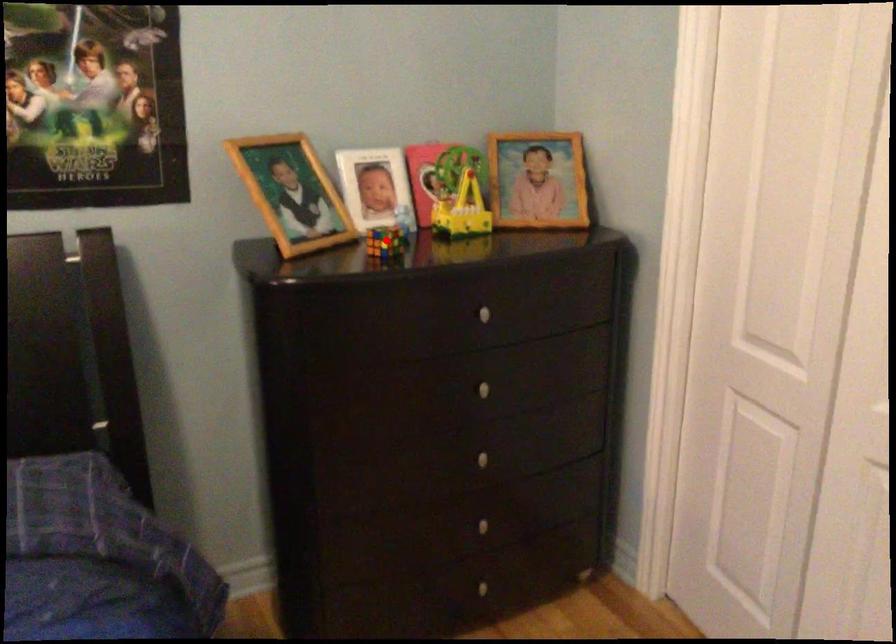
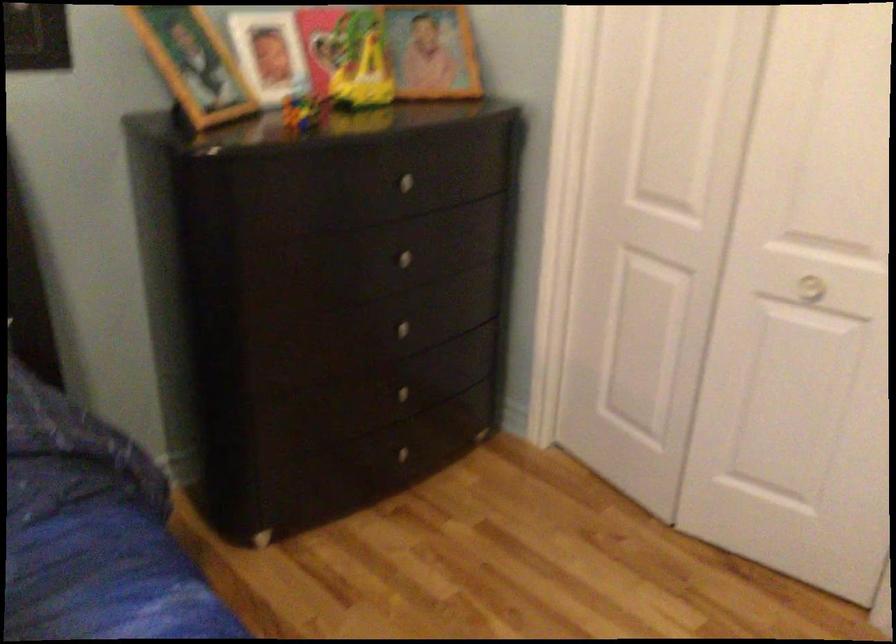
In the second image, find the point that corresponds to the highlighted location in the first image.

(303, 111)